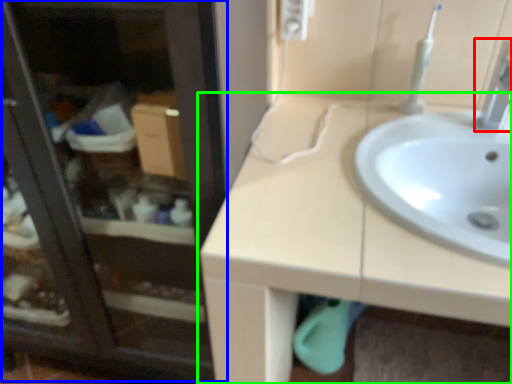
Question: Which object is the closest to the tap (highlighted by a red box)? Choose among these: screen door (highlighted by a blue box) or countertop (highlighted by a green box).

Choices:
 (A) screen door
 (B) countertop

Answer: (B)